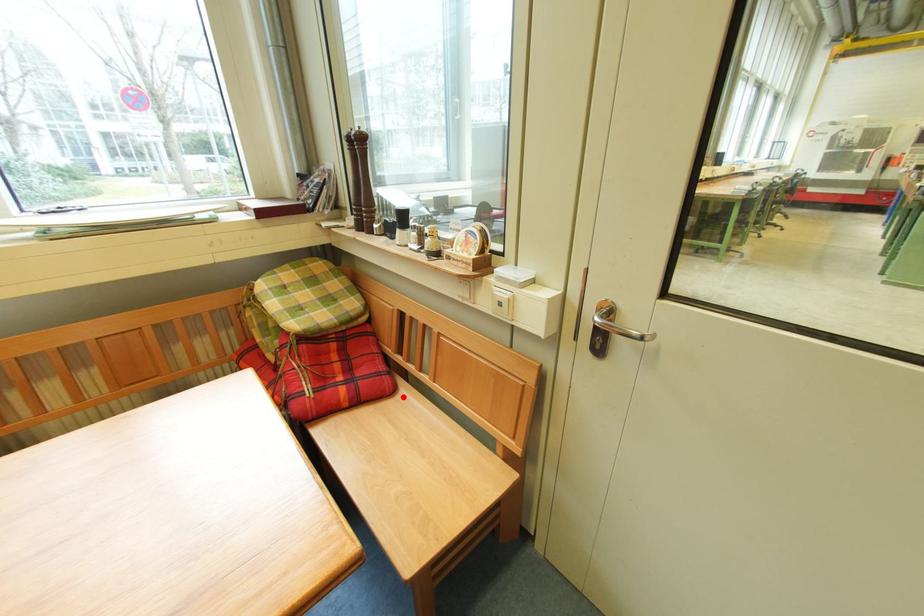
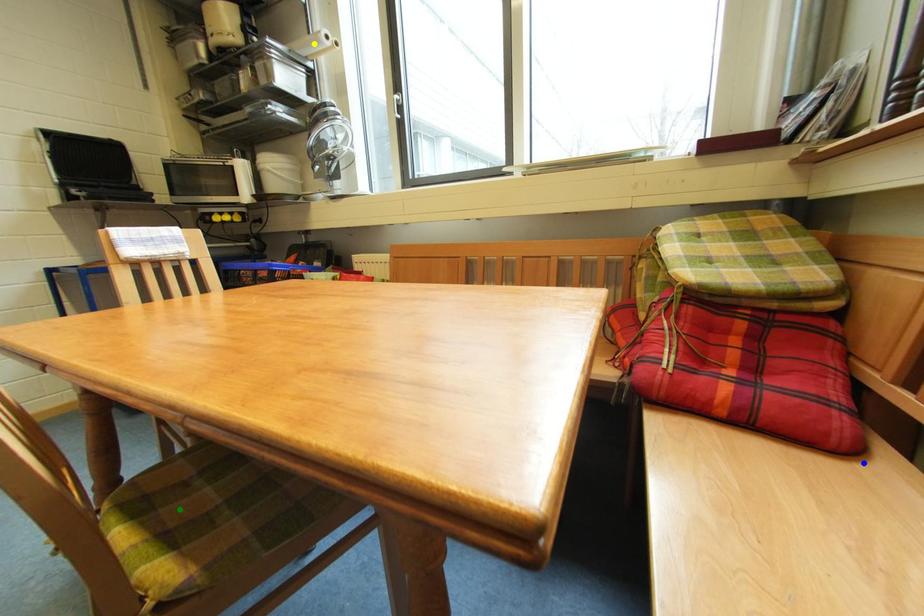
Question: I am providing you with two images of the same scene from different viewpoints. A red point is marked on the first image. You are given multiple points on the second image. Which point in image 2 represents the same 3d spot as the red point in image 1?

Choices:
 (A) green point
 (B) blue point
 (C) yellow point

Answer: (B)